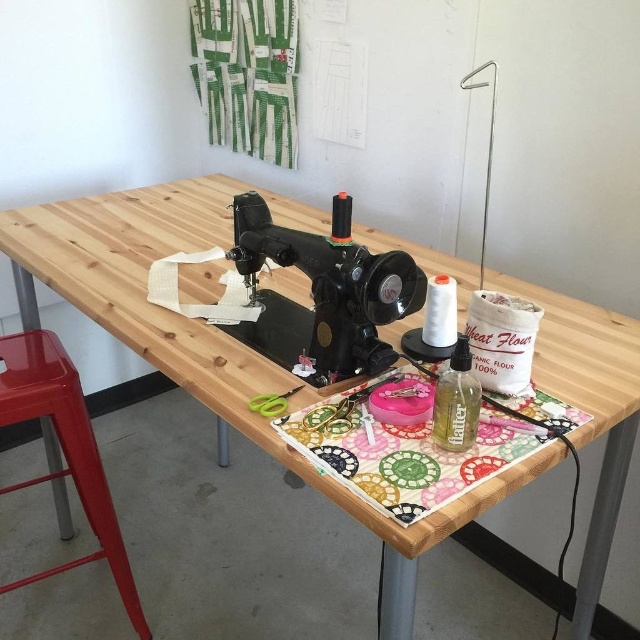
Question: Which object is closer to the camera taking this photo?

Choices:
 (A) wooden table at center
 (B) clear plastic bottle at center

Answer: (A)

Question: Does wooden table at center have a smaller size compared to black metal sewing machine at center?

Choices:
 (A) no
 (B) yes

Answer: (A)

Question: Is the position of wooden table at center more distant than that of green plastic scissors at center?

Choices:
 (A) no
 (B) yes

Answer: (A)

Question: Which object appears farthest from the camera in this image?

Choices:
 (A) green plastic scissors at center
 (B) wooden table at center

Answer: (A)

Question: Where is wooden table at center located in relation to green plastic scissors at center in the image?

Choices:
 (A) left
 (B) right

Answer: (A)

Question: Which object appears closest to the camera in this image?

Choices:
 (A) wooden table at center
 (B) metallic red stool at lower left

Answer: (A)